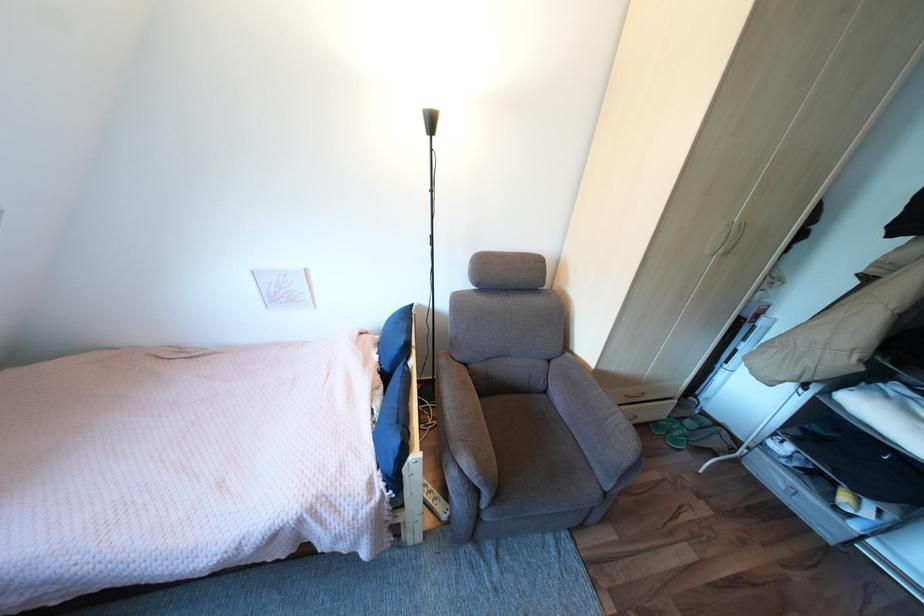
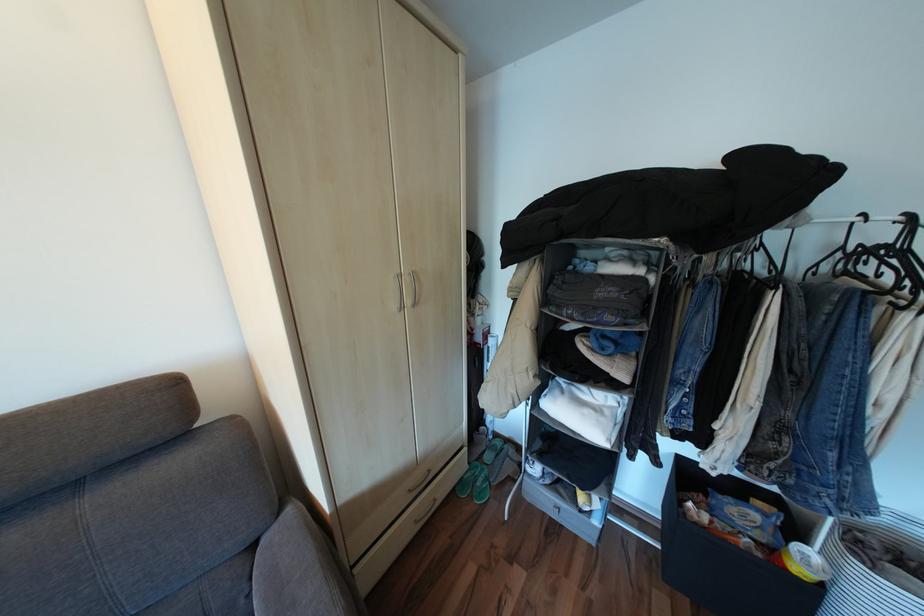
Find the pixel in the second image that matches (x=560, y=361) in the first image.

(263, 545)